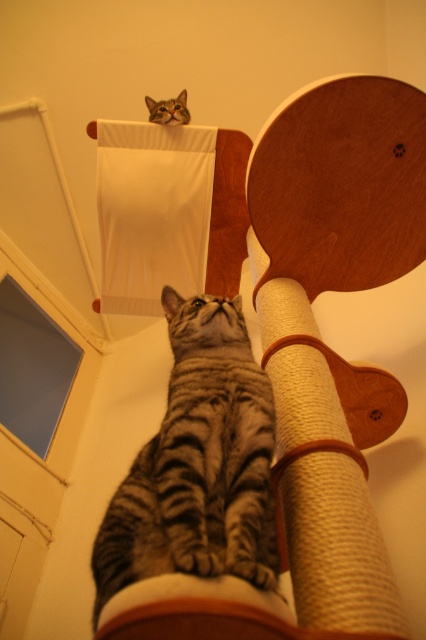
Is point (388, 150) closer to viewer compared to point (178, 120)?

Yes.

This screenshot has width=426, height=640. Describe the element at coordinates (317, 330) in the screenshot. I see `sanded wood scratching post at center` at that location.

This screenshot has height=640, width=426. Find the location of `sanded wood scratching post at center`. sanded wood scratching post at center is located at coordinates (317, 330).

Between gray tabby cat at center and tabby fur cat at upper center, which one appears on the right side from the viewer's perspective?

gray tabby cat at center is more to the right.

Is point (215, 468) positioned after point (164, 109)?

No, it is in front of (164, 109).

Is point (181, 376) more distant than point (164, 112)?

No, (181, 376) is in front of (164, 112).

Image resolution: width=426 pixels, height=640 pixels. Find the location of `gray tabby cat at center`. gray tabby cat at center is located at coordinates (198, 464).

Is point (402, 134) more distant than point (178, 445)?

That is True.

Is sanded wood scratching post at center closer to the viewer compared to gray tabby cat at center?

No.

Does point (267, 300) come in front of point (224, 456)?

No, it is behind (224, 456).

You are a GUI agent. You are given a task and a screenshot of the screen. Output one action in this format:
    pyautogui.click(x=<x>, y=<y>)
    Task: Click on the sanded wood scratching post at center
    The height and width of the screenshot is (640, 426).
    Given the screenshot: What is the action you would take?
    pyautogui.click(x=317, y=330)